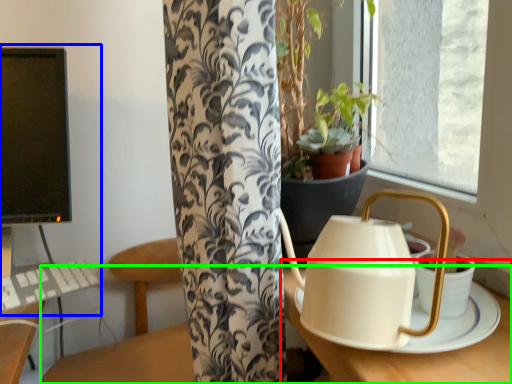
Question: Which object is positioned farthest from round table (highlighted by a red box)? Select from desktop computer (highlighted by a blue box) and table (highlighted by a green box).

Choices:
 (A) desktop computer
 (B) table

Answer: (A)